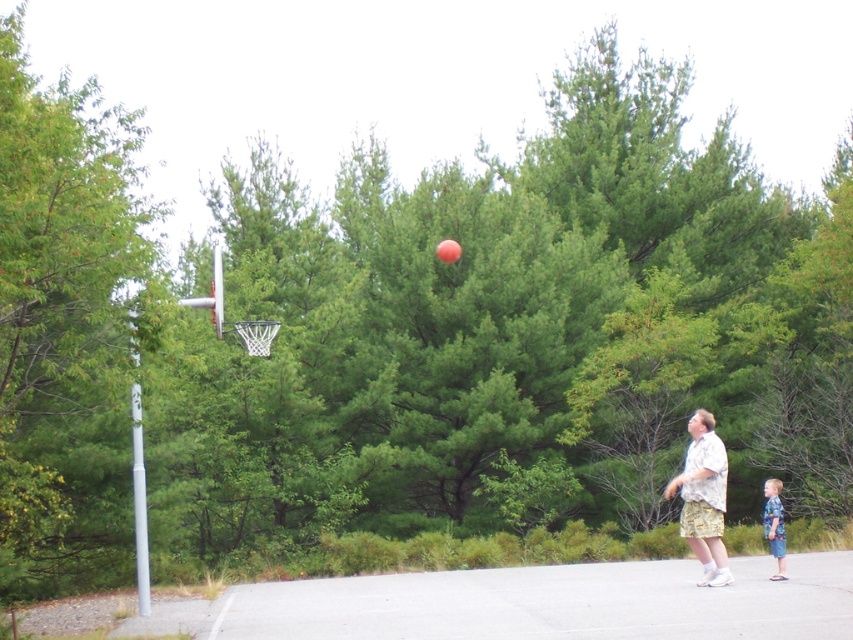
You are a photographer positioned behind the basketball hoop. You want to take a photo that includes both the light brown textured shorts at lower right and the blue plaid shirt at lower right. Which object should you focus on first to ensure both are in the frame?

The light brown textured shorts at lower right is closer to the viewer than the blue plaid shirt at lower right, so focus on the light brown textured shorts at lower right first to ensure both are in the frame.

You are a photographer setting up a shot of the basketball scene. You need to ensure that both the light brown textured shorts at lower right and the blue plaid shirt at lower right are visible in the frame. Based on their positions, which clothing item is covering part of the other?

The light brown textured shorts at lower right is positioned over the blue plaid shirt at lower right, so the shorts are covering part of the shirt.